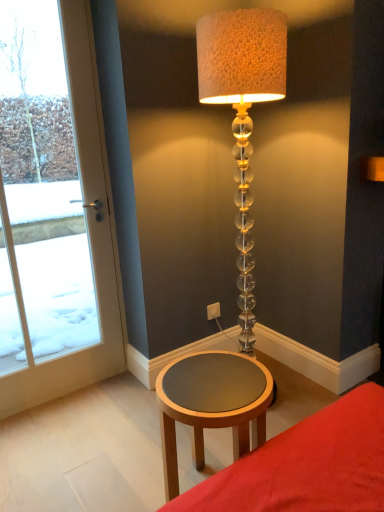
Identify the location of vacant region above wooden round table at lower center (from a real-world perspective). [x=211, y=383].